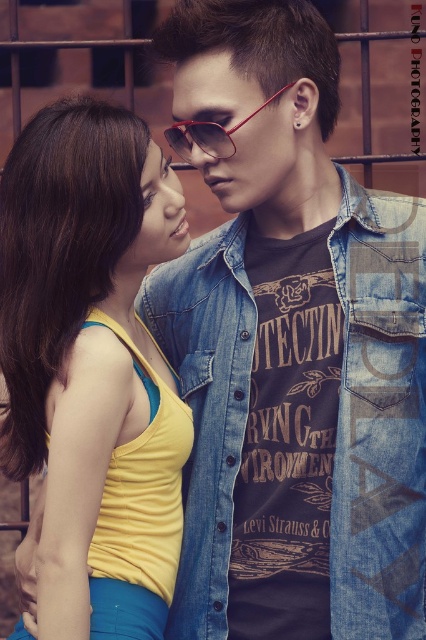
Question: Is yellow fabric tank top at left thinner than denim jacket at center?

Choices:
 (A) yes
 (B) no

Answer: (A)

Question: Which of the following is the closest to the observer?

Choices:
 (A) (412, 426)
 (B) (181, 509)
 (C) (166, 131)

Answer: (A)

Question: Where is yellow fabric tank top at left located in relation to shiny red sunglasses at center in the image?

Choices:
 (A) below
 (B) above

Answer: (A)

Question: Is denim jacket at center positioned at the back of shiny red sunglasses at center?

Choices:
 (A) no
 (B) yes

Answer: (B)

Question: Which is nearer to the shiny red sunglasses at center?

Choices:
 (A) denim jacket at center
 (B) yellow fabric tank top at left

Answer: (B)

Question: Which of the following is the farthest from the observer?

Choices:
 (A) (201, 426)
 (B) (184, 435)

Answer: (A)